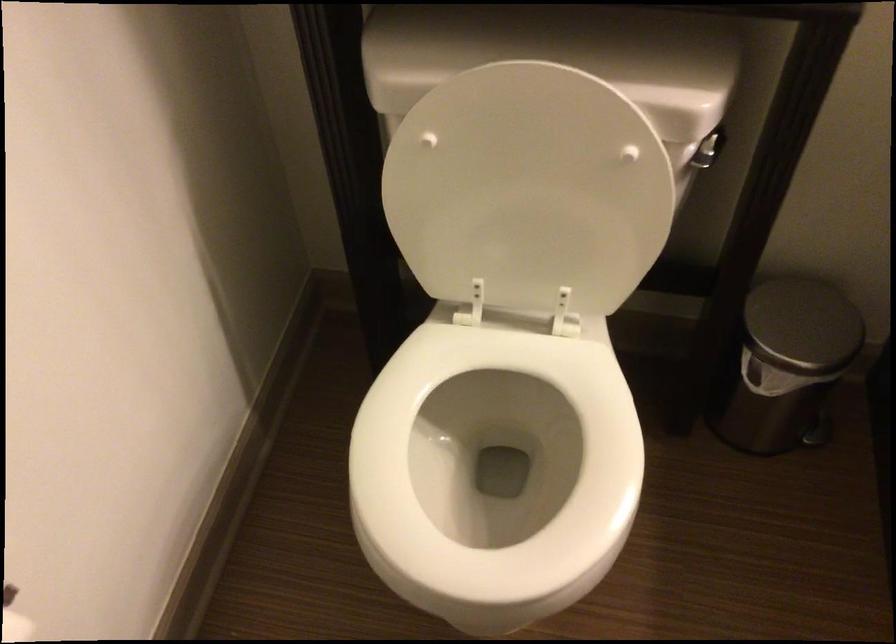
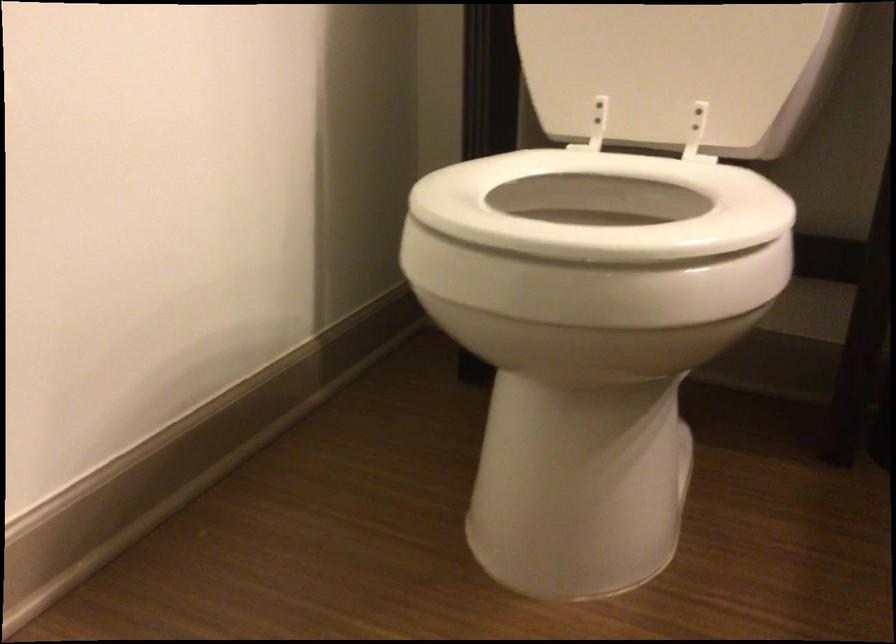
In the second image, find the point that corresponds to [543,261] in the first image.

(677, 71)